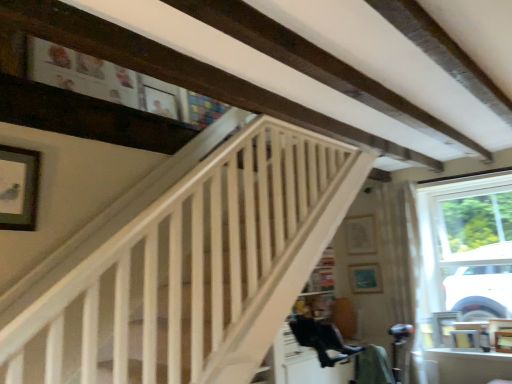
Image resolution: width=512 pixels, height=384 pixels. Find the location of `sheer white curtain at right`. sheer white curtain at right is located at coordinates (400, 250).

At what (x,y) coordinates should I click in order to perform the action: click on matte blue picture frame at center, which is counted as the 2th picture frame, starting from the right. Please return your answer as a coordinate pair (x, y). The height and width of the screenshot is (384, 512). Looking at the image, I should click on (365, 278).

This screenshot has width=512, height=384. In order to click on matte white picture frame at upper center, arranged as the 2th picture frame when viewed from the left in this screenshot , I will do `click(360, 235)`.

The image size is (512, 384). Describe the element at coordinates (503, 341) in the screenshot. I see `wooden picture frame at lower right, arranged as the 1th picture frame when ordered from the bottom` at that location.

The image size is (512, 384). What do you see at coordinates (205, 264) in the screenshot?
I see `white wooden stairwell at upper center` at bounding box center [205, 264].

Find the location of a particular element. Image resolution: width=512 pixels, height=384 pixels. sheer white curtain at right is located at coordinates (400, 250).

Looking at this image, from a real-world perspective, which object stands above the other?

From a 3D spatial view, matte white picture frame at upper center, which is the first picture frame in back-to-front order, is above.

Is matte white picture frame at upper center, the 2th picture frame when ordered from top to bottom, with sheer white curtain at right?

They are not placed beside each other.

Where is `curtain below the matte white picture frame at upper center, the third picture frame from the bottom (from the image's perspective)`? The image size is (512, 384). curtain below the matte white picture frame at upper center, the third picture frame from the bottom (from the image's perspective) is located at coordinates (400, 250).

Considering the sizes of objects matte white picture frame at upper center, the 2th picture frame when ordered from top to bottom, and sheer white curtain at right in the image provided, who is bigger, matte white picture frame at upper center, the 2th picture frame when ordered from top to bottom, or sheer white curtain at right?

sheer white curtain at right is bigger.

Is sheer white curtain at right taller or shorter than matte black picture frame at upper left, which appears as the 1th picture frame when viewed from the left?

sheer white curtain at right is taller than matte black picture frame at upper left, which appears as the 1th picture frame when viewed from the left.

Identify the location of the 2nd picture frame in front of the sheer white curtain at right, counting from the anchor's position. This screenshot has height=384, width=512. (19, 188).

How different are the orientations of matte white picture frame at upper center, the fourth picture frame when ordered from front to back, and wooden picture frame at lower right, which is the fourth picture frame in left-to-right order, in degrees?

2.95 degrees.

From the image's perspective, does matte white picture frame at upper center, the fourth picture frame when ordered from front to back, appear lower than wooden picture frame at lower right, arranged as the 1th picture frame when ordered from the bottom?

No.

Is the position of matte white picture frame at upper center, arranged as the 2th picture frame when viewed from the left, more distant than that of wooden picture frame at lower right, which is the fourth picture frame in left-to-right order?

Yes, it is.

Is matte white picture frame at upper center, the third picture frame from the bottom, bigger than wooden picture frame at lower right, arranged as the 1th picture frame when ordered from the bottom?

Actually, matte white picture frame at upper center, the third picture frame from the bottom, might be smaller than wooden picture frame at lower right, arranged as the 1th picture frame when ordered from the bottom.

Is sheer white curtain at right beside white wooden stairwell at upper center?

No, sheer white curtain at right is not next to white wooden stairwell at upper center.

Considering the positions of point (419, 374) and point (129, 308), is point (419, 374) closer or farther from the camera than point (129, 308)?

Point (419, 374).

Does matte white picture frame at upper center, arranged as the 2th picture frame when viewed from the left, have a lesser height compared to matte black picture frame at upper left, the 1th picture frame viewed from the front?

Yes, matte white picture frame at upper center, arranged as the 2th picture frame when viewed from the left, is shorter than matte black picture frame at upper left, the 1th picture frame viewed from the front.

Does matte white picture frame at upper center, the third picture frame from the bottom, touch matte black picture frame at upper left, which appears as the fourth picture frame when viewed from the back?

No, matte white picture frame at upper center, the third picture frame from the bottom, is not next to matte black picture frame at upper left, which appears as the fourth picture frame when viewed from the back.

In the image, is matte white picture frame at upper center, arranged as the 2th picture frame when viewed from the left, positioned in front of or behind matte black picture frame at upper left, which ranks as the 1th picture frame in top-to-bottom order?

In the image, matte white picture frame at upper center, arranged as the 2th picture frame when viewed from the left, appears behind matte black picture frame at upper left, which ranks as the 1th picture frame in top-to-bottom order.

Would you say matte white picture frame at upper center, which is the first picture frame in back-to-front order, is to the left or to the right of matte black picture frame at upper left, the 4th picture frame in the bottom-to-top sequence, in the picture?

From the image, it's evident that matte white picture frame at upper center, which is the first picture frame in back-to-front order, is to the right of matte black picture frame at upper left, the 4th picture frame in the bottom-to-top sequence.

Between matte white picture frame at upper center, acting as the third picture frame starting from the right, and white wooden stairwell at upper center, which one has more height?

Standing taller between the two is white wooden stairwell at upper center.

From a real-world perspective, is matte white picture frame at upper center, the third picture frame from the bottom, positioned above or below white wooden stairwell at upper center?

Clearly, from a real-world perspective, matte white picture frame at upper center, the third picture frame from the bottom, is above white wooden stairwell at upper center.

Is matte white picture frame at upper center, acting as the third picture frame starting from the right, not near white wooden stairwell at upper center?

Absolutely, matte white picture frame at upper center, acting as the third picture frame starting from the right, is distant from white wooden stairwell at upper center.

Is matte black picture frame at upper left, which ranks as the 1th picture frame in top-to-bottom order, inside or outside of sheer white curtain at right?

The correct answer is: outside.

Is matte black picture frame at upper left, which is counted as the fourth picture frame, starting from the right, thinner than sheer white curtain at right?

Indeed, matte black picture frame at upper left, which is counted as the fourth picture frame, starting from the right, has a lesser width compared to sheer white curtain at right.

From the image's perspective, is matte black picture frame at upper left, the 1th picture frame viewed from the front, on top of sheer white curtain at right?

Yes.

How distant is matte black picture frame at upper left, which ranks as the 1th picture frame in top-to-bottom order, from sheer white curtain at right?

They are 10.21 feet apart.

Locate an element on the screen. The width and height of the screenshot is (512, 384). picture frame that is the 1st one when counting upward from the sheer white curtain at right (from the image's perspective) is located at coordinates (360, 235).

The height and width of the screenshot is (384, 512). I want to click on curtain below the matte black picture frame at upper left, which appears as the fourth picture frame when viewed from the back (from a real-world perspective), so click(400, 250).

Looking at the image, which one is located further to matte white picture frame at upper center, which is the first picture frame in back-to-front order, white wooden stairwell at upper center or sheer white curtain at right?

Based on the image, white wooden stairwell at upper center appears to be further to matte white picture frame at upper center, which is the first picture frame in back-to-front order.

When comparing their distances from wooden picture frame at lower right, which is the fourth picture frame in left-to-right order, does sheer white curtain at right or matte black picture frame at upper left, the 1th picture frame viewed from the front, seem closer?

sheer white curtain at right lies closer to wooden picture frame at lower right, which is the fourth picture frame in left-to-right order, than the other object.

Which object lies further to the anchor point matte black picture frame at upper left, the 4th picture frame in the bottom-to-top sequence, wooden picture frame at lower right, placed as the second picture frame when sorted from front to back, or matte blue picture frame at center, which is counted as the third picture frame, starting from the left?

The object further to matte black picture frame at upper left, the 4th picture frame in the bottom-to-top sequence, is wooden picture frame at lower right, placed as the second picture frame when sorted from front to back.

Which object lies further to the anchor point matte black picture frame at upper left, the 4th picture frame in the bottom-to-top sequence, sheer white curtain at right or matte blue picture frame at center, the 3th picture frame when ordered from top to bottom?

matte blue picture frame at center, the 3th picture frame when ordered from top to bottom.

Based on their spatial positions, is matte black picture frame at upper left, which appears as the 1th picture frame when viewed from the left, or white wooden stairwell at upper center further from matte blue picture frame at center, which appears as the 3th picture frame when viewed from the front?

matte black picture frame at upper left, which appears as the 1th picture frame when viewed from the left, is positioned further to the anchor matte blue picture frame at center, which appears as the 3th picture frame when viewed from the front.

When comparing their distances from wooden picture frame at lower right, the third picture frame in the back-to-front sequence, does white wooden stairwell at upper center or matte blue picture frame at center, the 2th picture frame positioned from the bottom, seem closer?

Based on the image, matte blue picture frame at center, the 2th picture frame positioned from the bottom, appears to be nearer to wooden picture frame at lower right, the third picture frame in the back-to-front sequence.

Considering their positions, is matte black picture frame at upper left, the 4th picture frame in the bottom-to-top sequence, positioned closer to matte white picture frame at upper center, acting as the third picture frame starting from the right, than matte blue picture frame at center, the 3th picture frame when ordered from top to bottom?

Among the two, matte blue picture frame at center, the 3th picture frame when ordered from top to bottom, is located nearer to matte white picture frame at upper center, acting as the third picture frame starting from the right.

When comparing their distances from matte black picture frame at upper left, which is counted as the fourth picture frame, starting from the right, does wooden picture frame at lower right, placed as the second picture frame when sorted from front to back, or sheer white curtain at right seem closer?

Among the two, sheer white curtain at right is located nearer to matte black picture frame at upper left, which is counted as the fourth picture frame, starting from the right.

You are a GUI agent. You are given a task and a screenshot of the screen. Output one action in this format:
    pyautogui.click(x=<x>, y=<y>)
    Task: Click on the curtain between matte white picture frame at upper center, which is the first picture frame in back-to-front order, and wooden picture frame at lower right, which ranks as the 1th picture frame in right-to-left order
    Image resolution: width=512 pixels, height=384 pixels.
    Given the screenshot: What is the action you would take?
    pyautogui.click(x=400, y=250)

Identify the location of picture frame located between sheer white curtain at right and matte white picture frame at upper center, acting as the third picture frame starting from the right, in the depth direction. (365, 278).

Find the location of a particular element. stairwell between matte black picture frame at upper left, the 1th picture frame viewed from the front, and sheer white curtain at right is located at coordinates (205, 264).

Identify the location of picture frame situated between matte white picture frame at upper center, which is the first picture frame in back-to-front order, and wooden picture frame at lower right, the third picture frame in the back-to-front sequence, from left to right. (x=365, y=278).